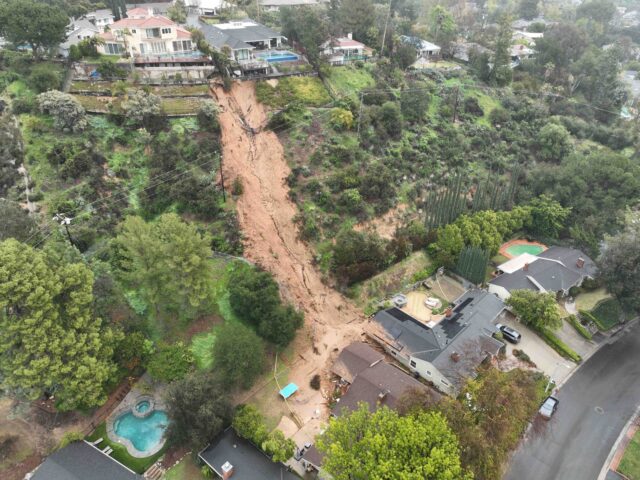
Where is `homes`? The height and width of the screenshot is (480, 640). homes is located at coordinates (156, 30), (418, 351), (543, 281), (368, 386), (100, 466), (228, 41), (349, 39), (431, 44), (524, 51), (80, 31).